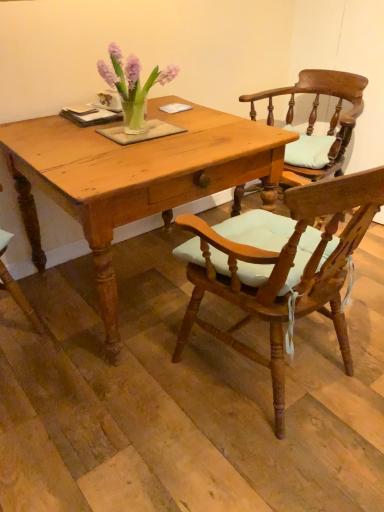
Question: In the image, is wooden chair with cushion at center, placed as the 1th chair when sorted from back to front, positioned in front of or behind light brown wooden table at center?

Choices:
 (A) front
 (B) behind

Answer: (B)

Question: Looking at their shapes, would you say wooden chair with cushion at center, which is counted as the second chair, starting from the front, is wider or thinner than light brown wooden table at center?

Choices:
 (A) thin
 (B) wide

Answer: (A)

Question: Based on their relative distances, which object is farther from the wooden chair with light blue cushion at center, which ranks as the second chair in back-to-front order?

Choices:
 (A) wooden chair with cushion at center, placed as the 1th chair when sorted from back to front
 (B) light brown wooden table at center

Answer: (A)

Question: Based on their relative distances, which object is farther from the light brown wooden table at center?

Choices:
 (A) wooden chair with light blue cushion at center, which appears as the first chair when viewed from the front
 (B) wooden chair with cushion at center, placed as the 1th chair when sorted from back to front

Answer: (B)